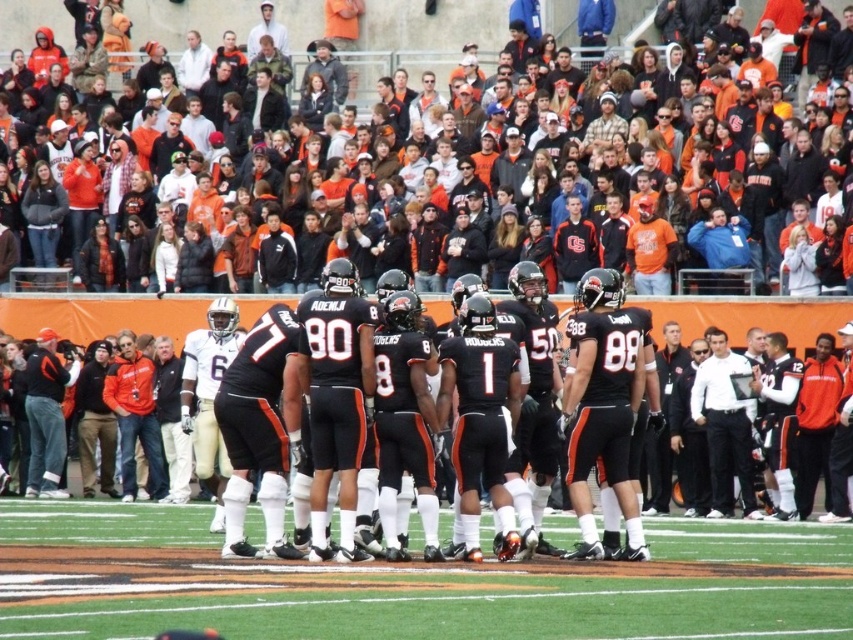
Between green turf at center and orange jersey fans at upper center, which one is positioned lower?

green turf at center is below.

Can you confirm if green turf at center is taller than orange jersey fans at upper center?

Incorrect, green turf at center's height is not larger of orange jersey fans at upper center's.

The image size is (853, 640). Find the location of `green turf at center`. green turf at center is located at coordinates (410, 582).

Find the location of `green turf at center`. green turf at center is located at coordinates (410, 582).

Between orange jersey fans at upper center and black matte football team at center, which one has more height?

orange jersey fans at upper center

Who is higher up, orange jersey fans at upper center or black matte football team at center?

orange jersey fans at upper center is higher up.

What do you see at coordinates (421, 38) in the screenshot? The height and width of the screenshot is (640, 853). I see `orange jersey fans at upper center` at bounding box center [421, 38].

Where is `orange jersey fans at upper center`? This screenshot has width=853, height=640. orange jersey fans at upper center is located at coordinates (421, 38).

Does green turf at center have a greater height compared to black matte football team at center?

In fact, green turf at center may be shorter than black matte football team at center.

Can you confirm if green turf at center is bigger than black matte football team at center?

Incorrect, green turf at center is not larger than black matte football team at center.

I want to click on green turf at center, so click(x=410, y=582).

Find the location of `green turf at center`. green turf at center is located at coordinates (410, 582).